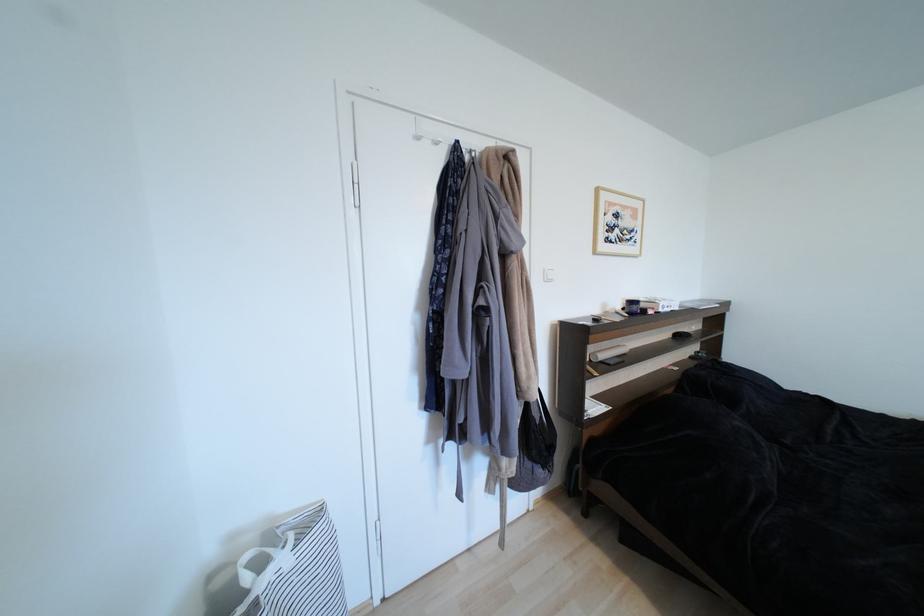
Identify the location of white light switch. (548, 275).